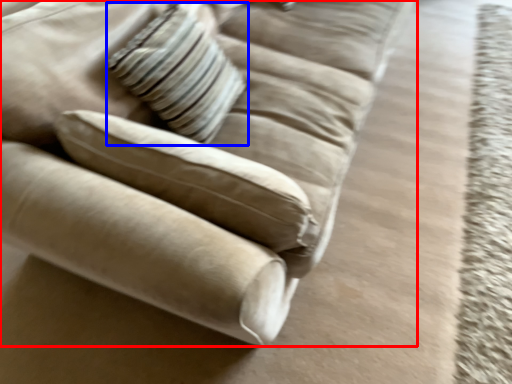
Question: Among these objects, which one is farthest to the camera, studio couch (highlighted by a red box) or pillow (highlighted by a blue box)?

Choices:
 (A) studio couch
 (B) pillow

Answer: (B)